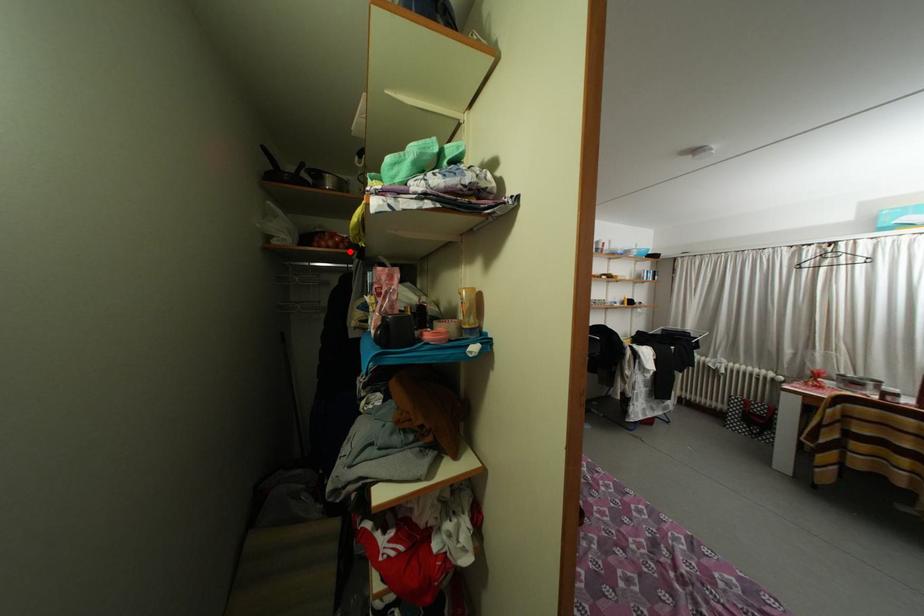
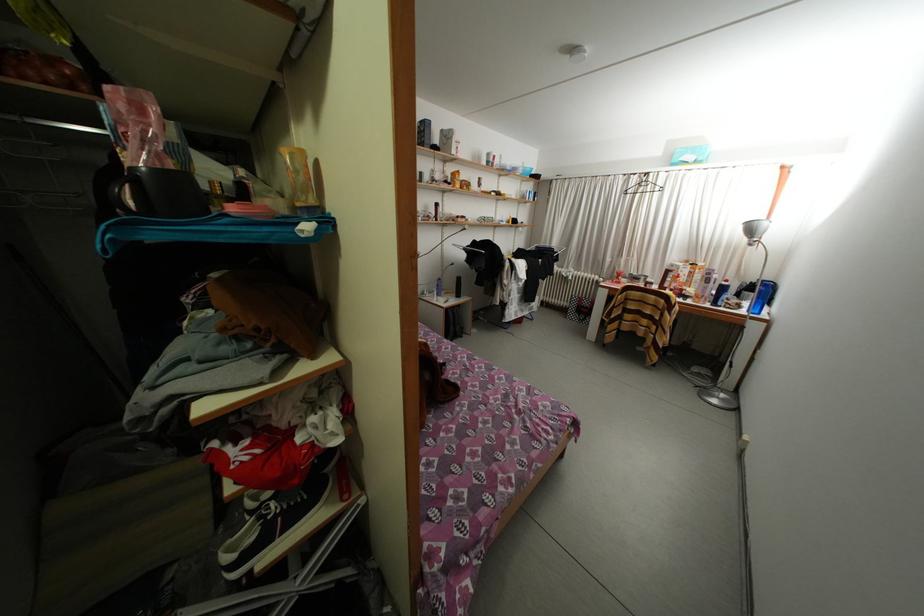
Where in the second image is the point corresponding to the highlighted location from the first image?

(91, 92)